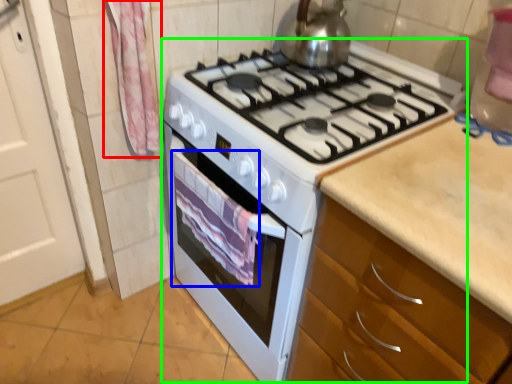
Question: Which object is positioned closest to curtain (highlighted by a red box)? Select from blanket (highlighted by a blue box) and appliance (highlighted by a green box).

Choices:
 (A) blanket
 (B) appliance

Answer: (A)